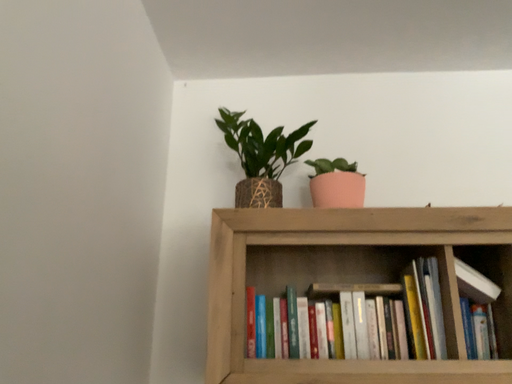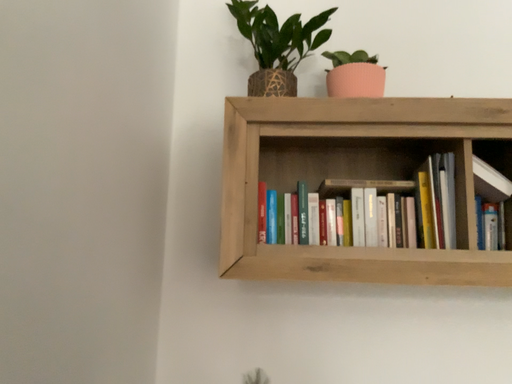
Question: Which way did the camera rotate in the video?

Choices:
 (A) rotated downward
 (B) rotated upward

Answer: (A)